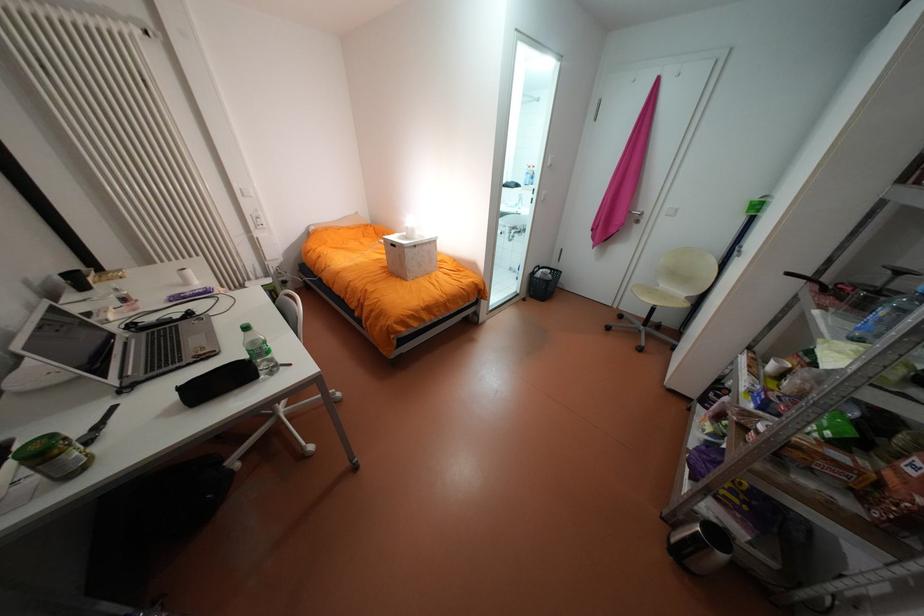
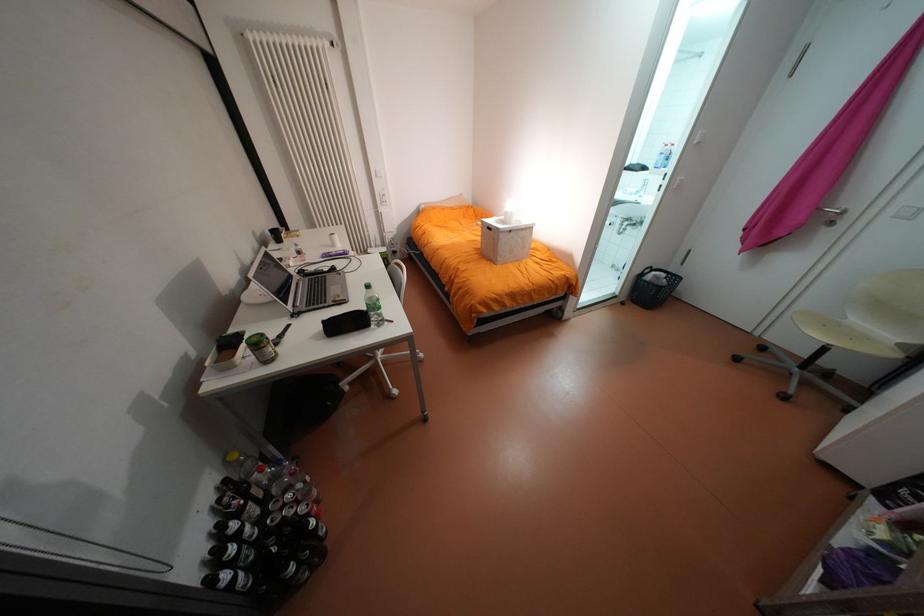
The point at (415, 249) is marked in the first image. Where is the corresponding point in the second image?

(509, 233)